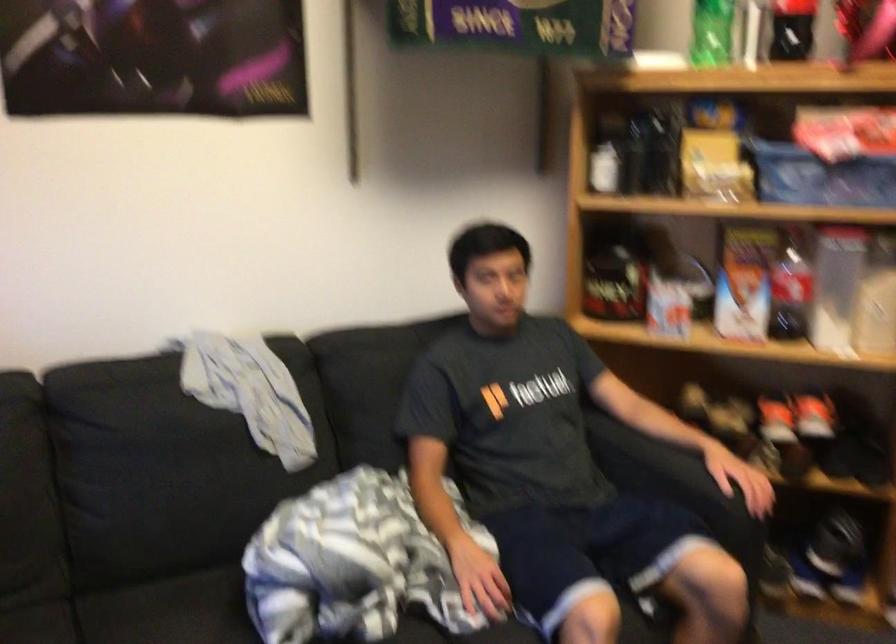
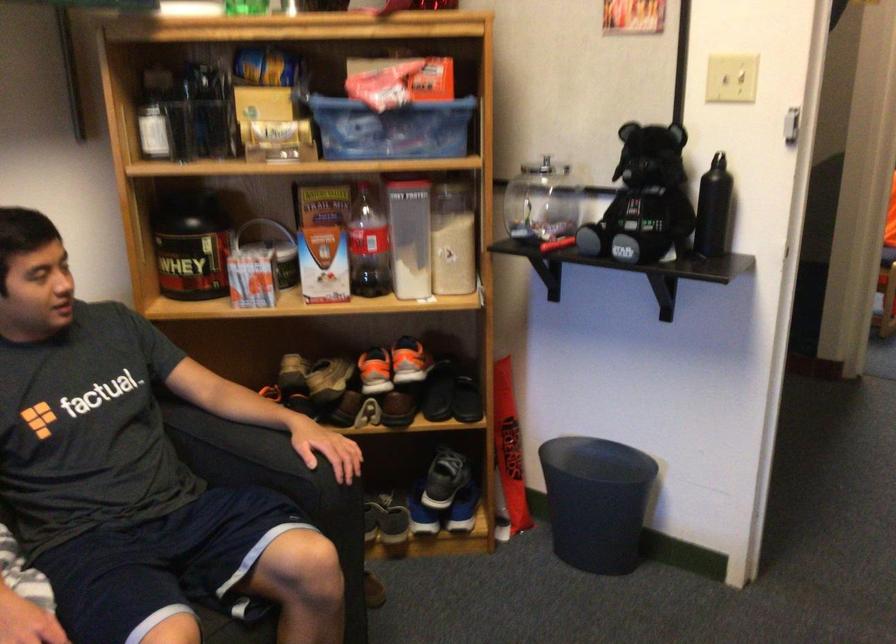
Find the pixel in the second image that matches pixel 661 468 in the first image.

(250, 455)